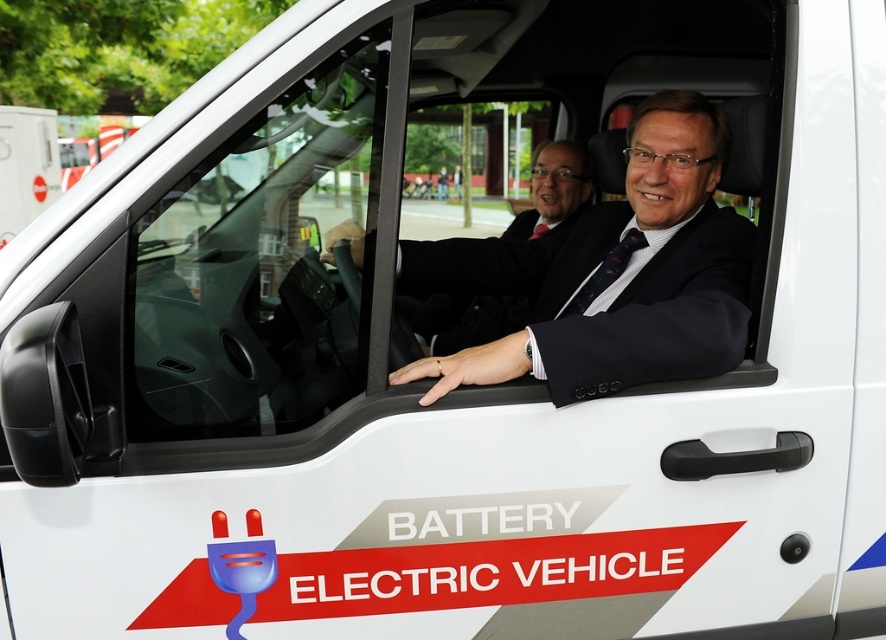
How far apart are dark blue suit at center and black textured tie at center?

dark blue suit at center is 7.46 inches from black textured tie at center.

Which of these two, dark blue suit at center or black textured tie at center, stands taller?

dark blue suit at center

You are a GUI agent. You are given a task and a screenshot of the screen. Output one action in this format:
    pyautogui.click(x=<x>, y=<y>)
    Task: Click on the dark blue suit at center
    This screenshot has width=886, height=640.
    Given the screenshot: What is the action you would take?
    pyautogui.click(x=610, y=273)

Measure the distance between dark blue suit at center and camera.

A distance of 5.54 feet exists between dark blue suit at center and camera.

Does dark blue suit at center appear over black silk tie at driver's seat?

No, dark blue suit at center is not above black silk tie at driver's seat.

Describe the element at coordinates (610, 273) in the screenshot. I see `dark blue suit at center` at that location.

Find the location of a particular element. The height and width of the screenshot is (640, 886). dark blue suit at center is located at coordinates (610, 273).

Between black textured tie at center and black silk tie at driver's seat, which one is positioned lower?

black textured tie at center

Who is positioned more to the left, black textured tie at center or black silk tie at driver's seat?

black silk tie at driver's seat is more to the left.

The image size is (886, 640). Describe the element at coordinates (605, 272) in the screenshot. I see `black textured tie at center` at that location.

What are the coordinates of `black textured tie at center` in the screenshot? It's located at (605, 272).